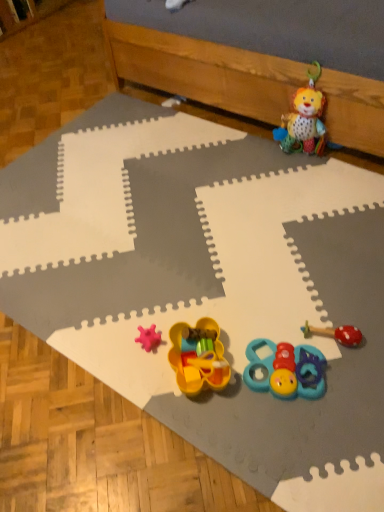
Where is `vacant space in between plush fabric lion at upper right, which is the 1th toy in back-to-front order, and yellow plastic toy at center, which appears as the 2th toy when ordered from the bottom`? vacant space in between plush fabric lion at upper right, which is the 1th toy in back-to-front order, and yellow plastic toy at center, which appears as the 2th toy when ordered from the bottom is located at coordinates (x=264, y=241).